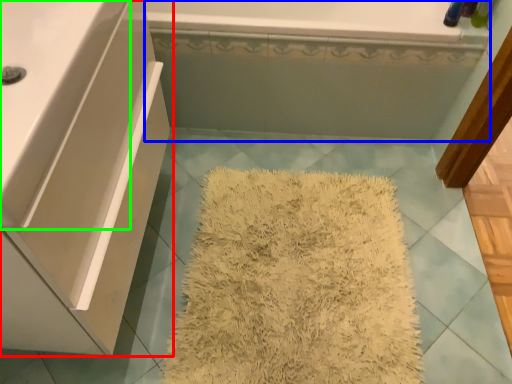
Question: Estimate the real-world distances between objects in this image. Which object is closer to bathroom cabinet (highlighted by a red box), bath (highlighted by a blue box) or counter top (highlighted by a green box)?

Choices:
 (A) bath
 (B) counter top

Answer: (B)